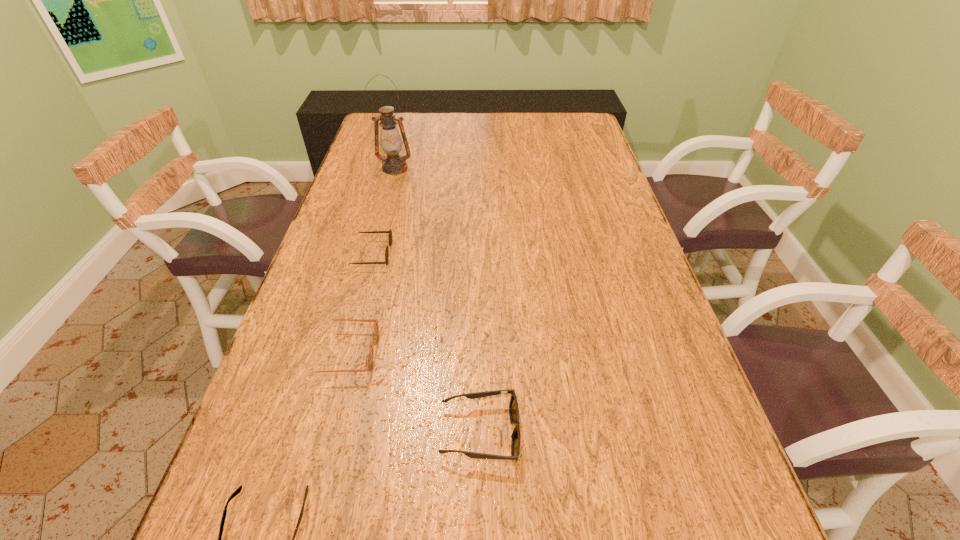
This screenshot has width=960, height=540. What are the coordinates of `unoccupied position between the oil lamp and the rightmost object` in the screenshot? It's located at (438, 300).

Find the location of a particular element. This screenshot has width=960, height=540. blank region between the third nearest sunglasses and the farthest object is located at coordinates (370, 261).

Select which object is the closest to the oil lamp. Please provide its 2D coordinates. Your answer should be formatted as a tuple, i.e. [(x, y)], where the tuple contains the x and y coordinates of a point satisfying the conditions above.

[(390, 232)]

Identify which object is located as the nearest to the farthest object. Please provide its 2D coordinates. Your answer should be formatted as a tuple, i.e. [(x, y)], where the tuple contains the x and y coordinates of a point satisfying the conditions above.

[(390, 232)]

Locate an element on the screen. The image size is (960, 540). sunglasses that is the closest to the rightmost object is located at coordinates (375, 331).

Image resolution: width=960 pixels, height=540 pixels. What are the coordinates of `sunglasses that is the third closest to the nearest object` in the screenshot? It's located at (390, 232).